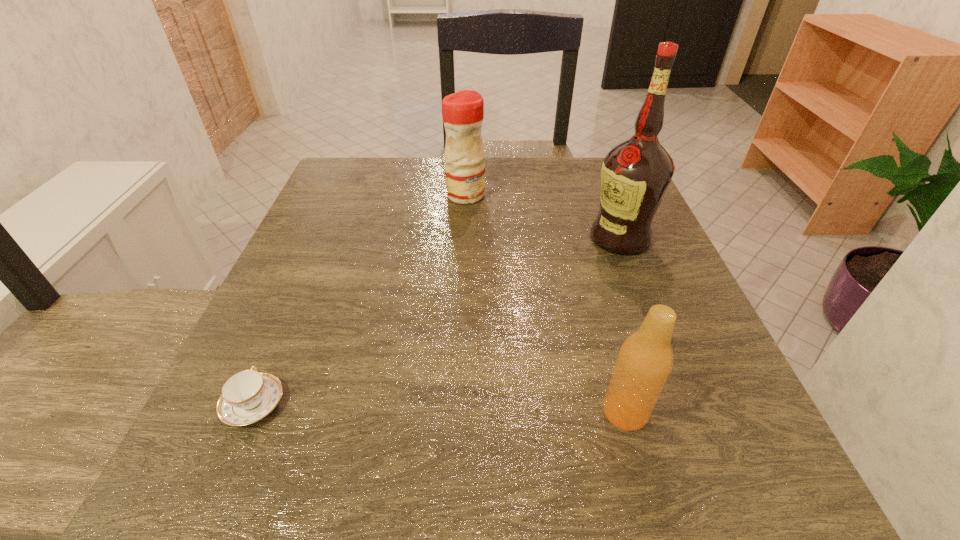
Locate an element on the screen. This screenshot has width=960, height=540. vacant area situated 0.220m on the front of the second tallest object is located at coordinates (462, 268).

Identify the location of vacant space located on the back of the third tallest object. Image resolution: width=960 pixels, height=540 pixels. (581, 248).

Locate an element on the screen. free space located 0.390m on the side with the handle of the teacup is located at coordinates (329, 227).

In order to click on free region located on the side with the handle of the teacup in this screenshot , I will do `click(276, 352)`.

The width and height of the screenshot is (960, 540). In order to click on free spot located on the side with the handle of the teacup in this screenshot , I will do `click(282, 338)`.

You are a GUI agent. You are given a task and a screenshot of the screen. Output one action in this format:
    pyautogui.click(x=<x>, y=<y>)
    Task: Click on the object positioned at the far edge
    Image resolution: width=960 pixels, height=540 pixels.
    Given the screenshot: What is the action you would take?
    pyautogui.click(x=462, y=112)

Where is `object present at the left edge`? Image resolution: width=960 pixels, height=540 pixels. object present at the left edge is located at coordinates (248, 396).

Locate an element on the screen. This screenshot has height=540, width=960. alcohol that is at the right edge is located at coordinates (635, 175).

The width and height of the screenshot is (960, 540). I want to click on beer bottle that is at the right edge, so click(645, 360).

Identify the location of vacant area at the far edge of the desktop. (408, 161).